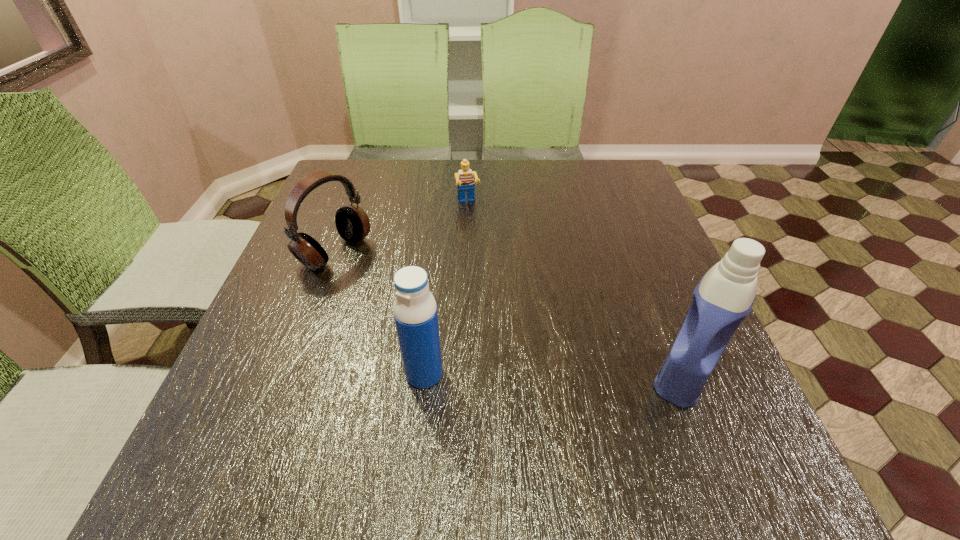
Where is `object that is positioned at the right edge`? Image resolution: width=960 pixels, height=540 pixels. object that is positioned at the right edge is located at coordinates (724, 297).

This screenshot has width=960, height=540. I want to click on object at the near right corner, so click(724, 297).

I want to click on free space at the far edge, so click(x=402, y=195).

In the image, there is a desktop. What are the coordinates of `blank space at the left edge` in the screenshot? It's located at (260, 365).

The height and width of the screenshot is (540, 960). In the image, there is a desktop. Find the location of `free space at the right edge`. free space at the right edge is located at coordinates (608, 214).

At what (x,y) coordinates should I click in order to perform the action: click on free space at the far left corner. Please return your answer as a coordinate pair (x, y). Looking at the image, I should click on (317, 198).

Where is `vacant area at the far right corner of the desktop`? The width and height of the screenshot is (960, 540). vacant area at the far right corner of the desktop is located at coordinates (630, 204).

You are a GUI agent. You are given a task and a screenshot of the screen. Output one action in this format:
    pyautogui.click(x=<x>, y=<y>)
    Task: Click on the unoccupied area between the water bottle and the rightmost object
    
    Given the screenshot: What is the action you would take?
    pyautogui.click(x=554, y=374)

Locate an element on the screen. Image resolution: width=960 pixels, height=540 pixels. vacant area between the third object from right to left and the second shortest object is located at coordinates (380, 313).

Find the location of a particular element. The width and height of the screenshot is (960, 540). vacant area between the farthest object and the detergent is located at coordinates (576, 289).